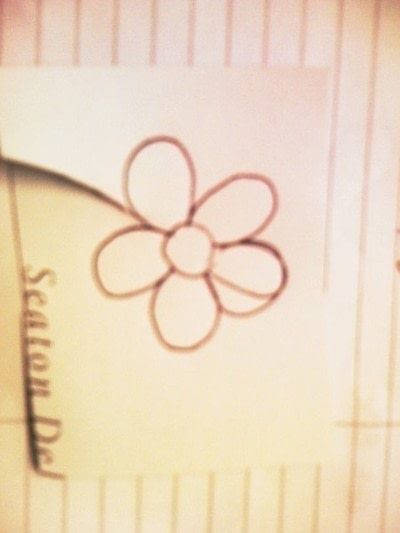
At what (x,y) coordinates should I click in order to perform the action: click on note paper above drawing. Please return your answer as a coordinate pair (x, y). Image resolution: width=400 pixels, height=533 pixels. Looking at the image, I should click on (167, 43).